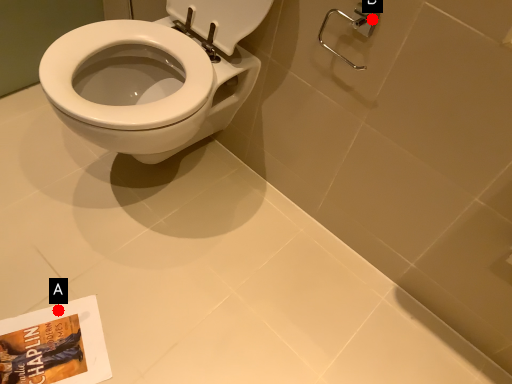
Question: Two points are circled on the image, labeled by A and B beside each circle. Which point appears farthest from the camera in this image?

Choices:
 (A) A is further
 (B) B is further

Answer: (A)